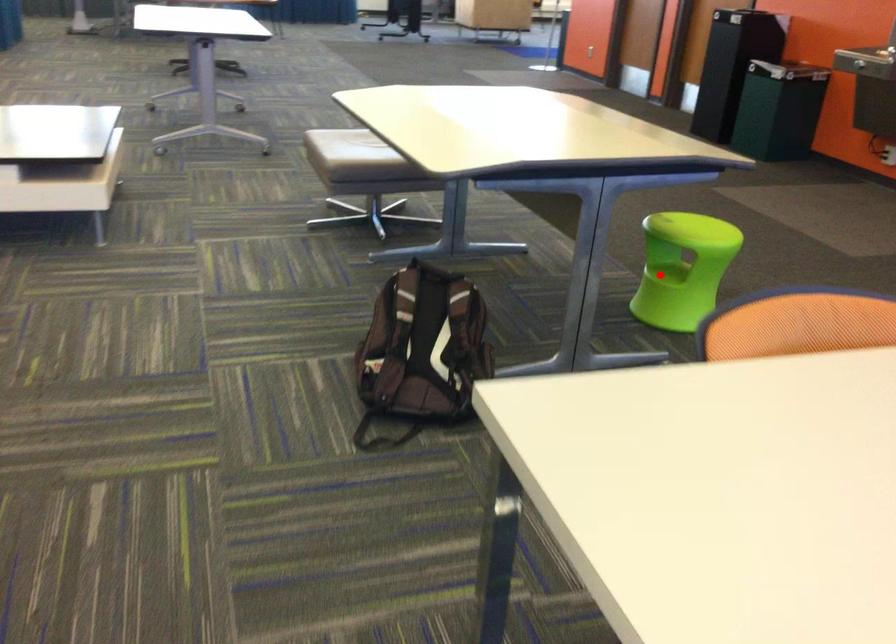
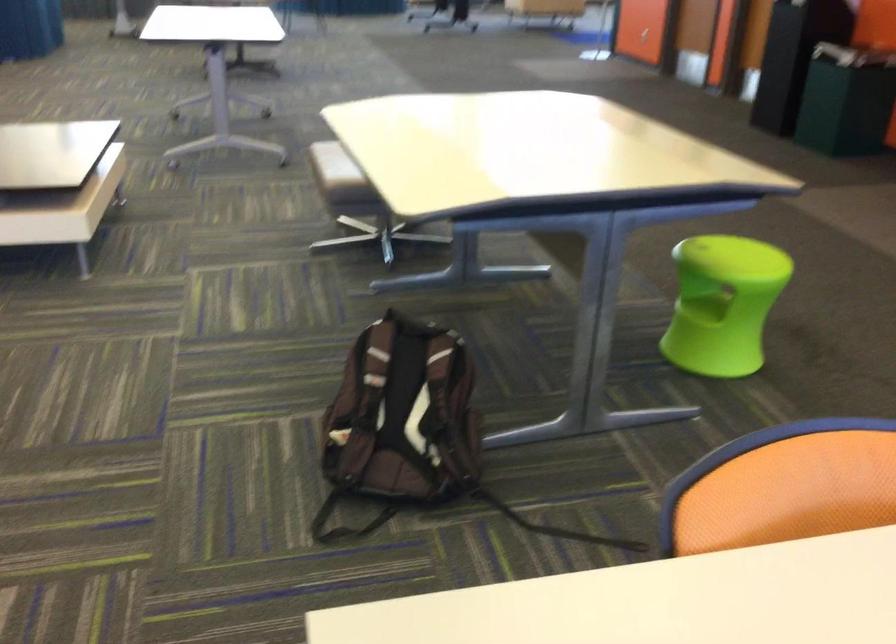
In the second image, find the point that corresponds to the highlighted location in the first image.

(702, 307)